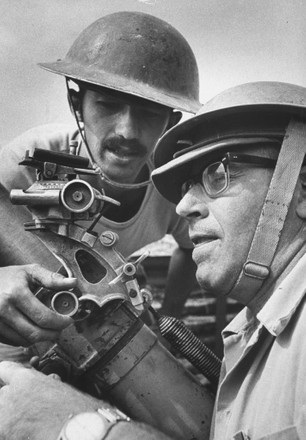
Where is `knob`? This screenshot has height=440, width=306. knob is located at coordinates (60, 305).